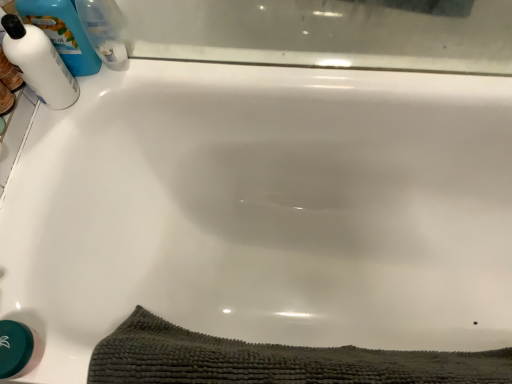
The image size is (512, 384). Identify the location of vacant point above dark gray textured bath towel at lower center (from a real-world perspective). (242, 369).